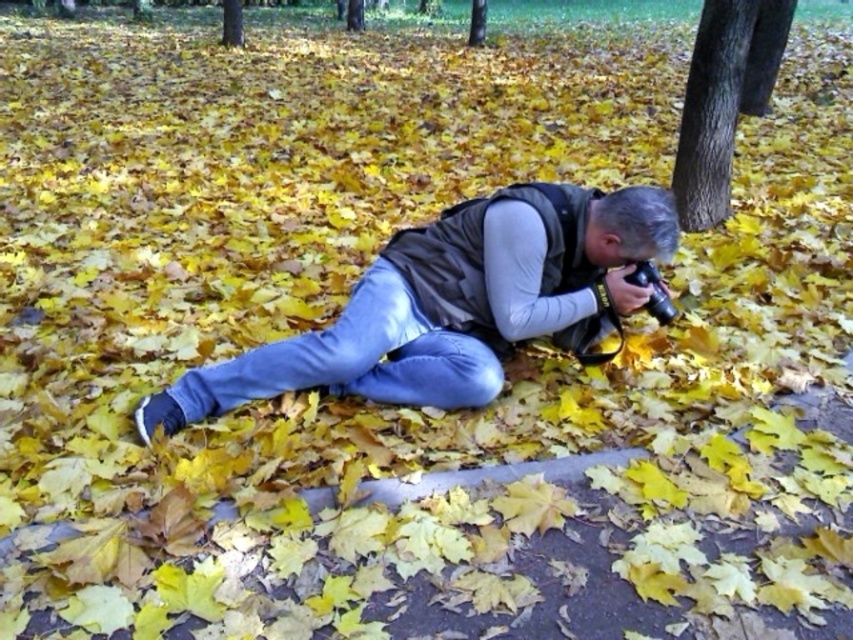
Measure the distance from smooth bark tree at center to brown textured tree at upper center.

They are 7.32 meters apart.

This screenshot has height=640, width=853. What do you see at coordinates (724, 99) in the screenshot? I see `smooth bark tree at center` at bounding box center [724, 99].

At what (x,y) coordinates should I click in order to perform the action: click on smooth bark tree at center. Please return your answer as a coordinate pair (x, y). The image size is (853, 640). Looking at the image, I should click on (724, 99).

Does brown textured tree at upper center appear over smooth bark tree at upper center?

Incorrect, brown textured tree at upper center is not positioned above smooth bark tree at upper center.

Who is positioned more to the right, brown textured tree at upper center or smooth bark tree at upper center?

Positioned to the right is smooth bark tree at upper center.

Between point (241, 33) and point (471, 24), which one is positioned behind?

Positioned behind is point (471, 24).

Identify the location of brown textured tree at upper center. The width and height of the screenshot is (853, 640). (231, 22).

Is smooth bark tree at center closer to the viewer compared to smooth bark tree at upper center?

Yes, it is.

Measure the distance between smooth bark tree at center and camera.

smooth bark tree at center is 9.93 feet from camera.

Locate an element on the screen. smooth bark tree at center is located at coordinates (724, 99).